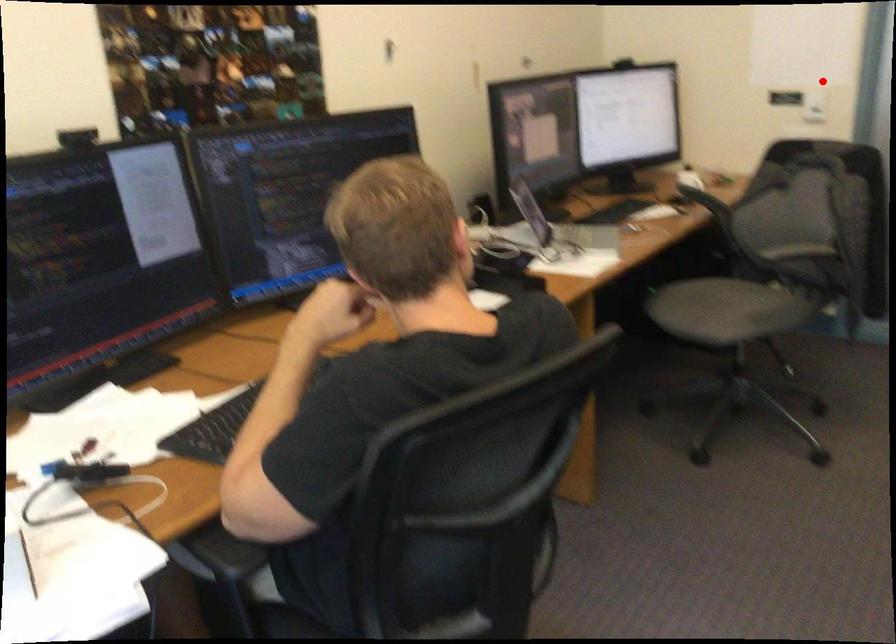
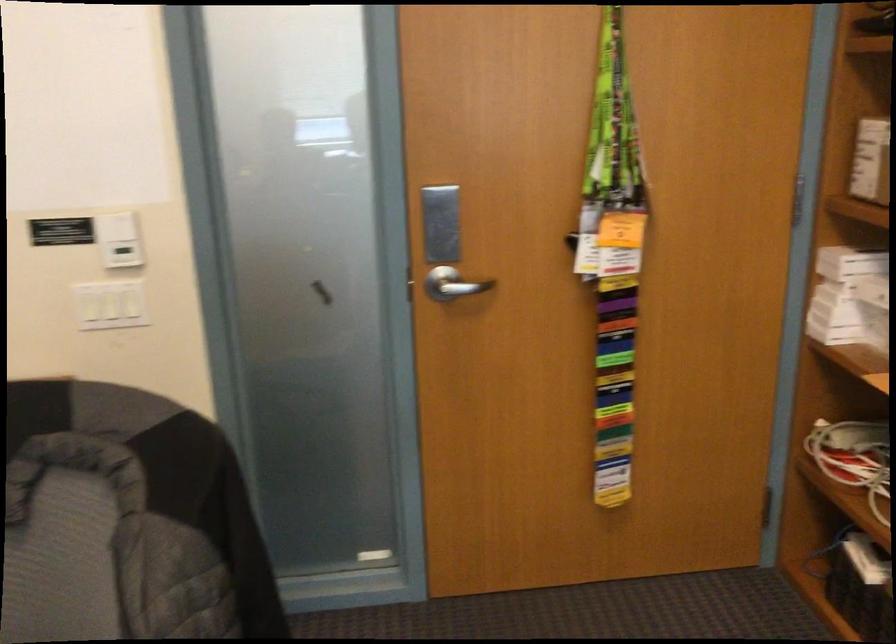
Question: I am providing you with two images of the same scene from different viewpoints. In image1, a red point is highlighted. Considering the same 3D point in image2, which of the following is correct?

Choices:
 (A) It is closer
 (B) It is farther

Answer: (A)